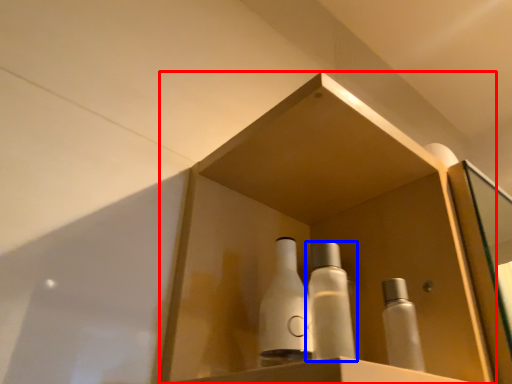
Question: Which object appears farthest to the camera in this image, shelf (highlighted by a red box) or bottle (highlighted by a blue box)?

Choices:
 (A) shelf
 (B) bottle

Answer: (B)